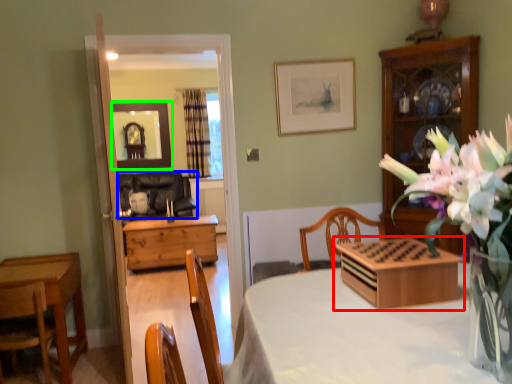
Question: Which object is the closest to the tableware (highlighted by a red box)? Choose among these: chair (highlighted by a blue box) or mirror (highlighted by a green box).

Choices:
 (A) chair
 (B) mirror

Answer: (A)